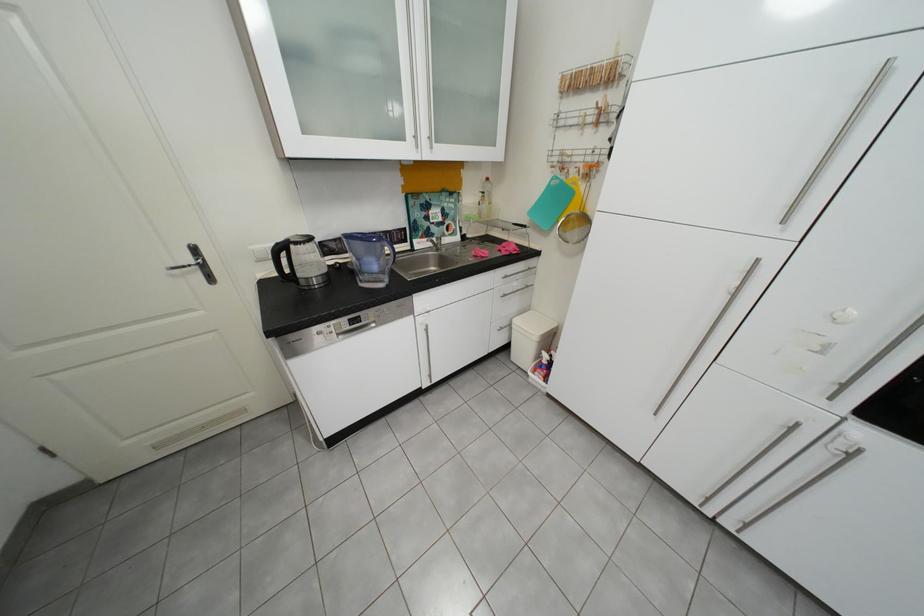
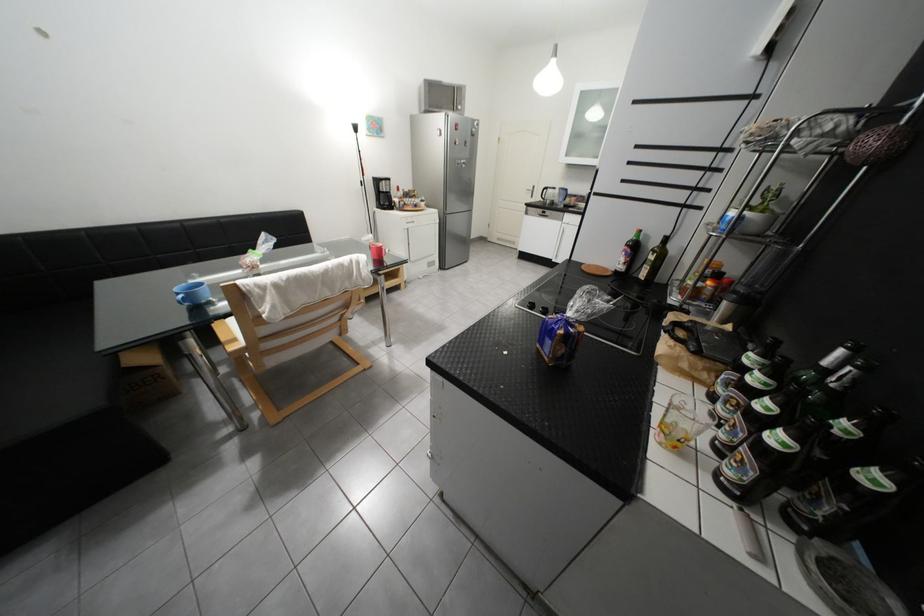
In the second image, find the point that corresponds to point (207, 252) in the first image.

(545, 188)